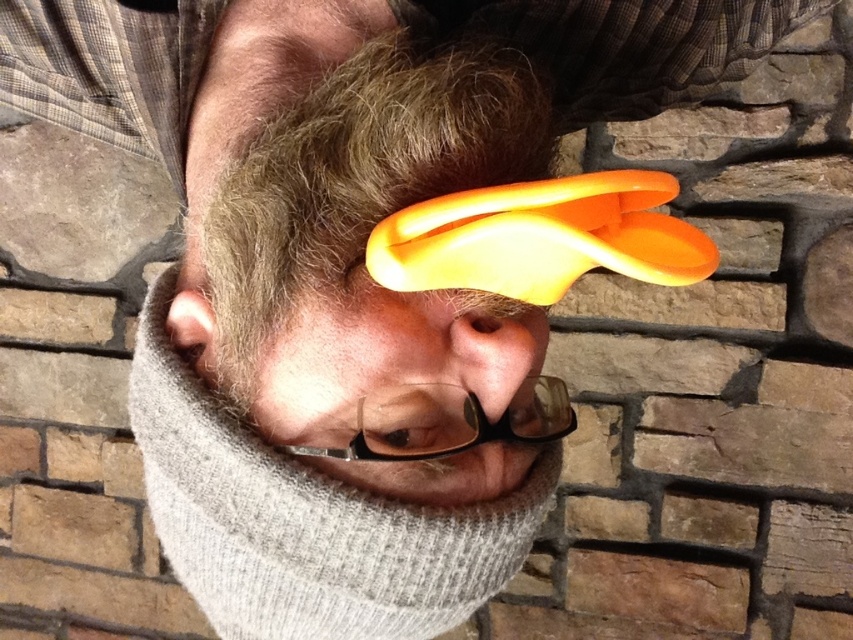
Can you confirm if brown fuzzy hair at center is thinner than transparent plastic glasses at center?

In fact, brown fuzzy hair at center might be wider than transparent plastic glasses at center.

Is point (479, 93) positioned in front of point (538, 380)?

Yes, it is.

Is point (403, 148) positioned behind point (473, 397)?

No, it is not.

This screenshot has width=853, height=640. Identify the location of brown fuzzy hair at center. (358, 180).

In the scene shown: Is gray woolen beard at center wider than transparent plastic glasses at center?

Correct, the width of gray woolen beard at center exceeds that of transparent plastic glasses at center.

Is gray woolen beard at center smaller than transparent plastic glasses at center?

Actually, gray woolen beard at center might be larger than transparent plastic glasses at center.

Find the location of a particular element. The height and width of the screenshot is (640, 853). gray woolen beard at center is located at coordinates (300, 529).

At what (x,y) coordinates should I click in order to perform the action: click on gray woolen beard at center. Please return your answer as a coordinate pair (x, y). The image size is (853, 640). Looking at the image, I should click on (300, 529).

What do you see at coordinates (358, 180) in the screenshot?
I see `brown fuzzy hair at center` at bounding box center [358, 180].

Is brown fuzzy hair at center below gray woolen beard at center?

Result: No.

Who is more distant from viewer, (238, 221) or (235, 509)?

Positioned behind is point (238, 221).

At what (x,y) coordinates should I click in order to perform the action: click on brown fuzzy hair at center. Please return your answer as a coordinate pair (x, y). The image size is (853, 640). Looking at the image, I should click on pyautogui.click(x=358, y=180).